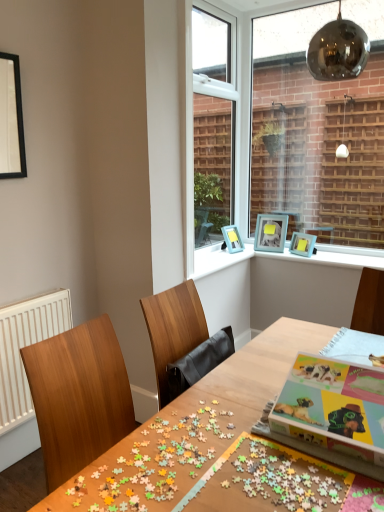
Image resolution: width=384 pixels, height=512 pixels. I want to click on blank space situated above wooden table at center (from a real-world perspective), so click(x=256, y=416).